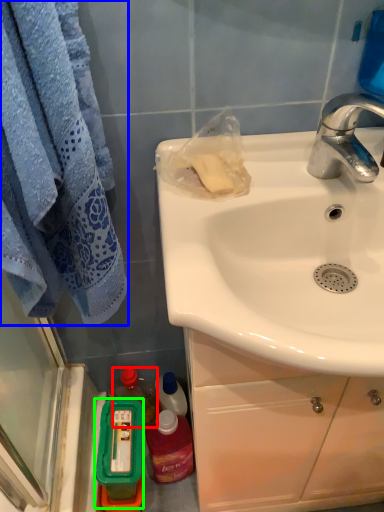
Question: Considering the real-world distances, which object is closest to bottle (highlighted by a red box)? towel/napkin (highlighted by a blue box) or mouthwash (highlighted by a green box).

Choices:
 (A) towel/napkin
 (B) mouthwash

Answer: (B)